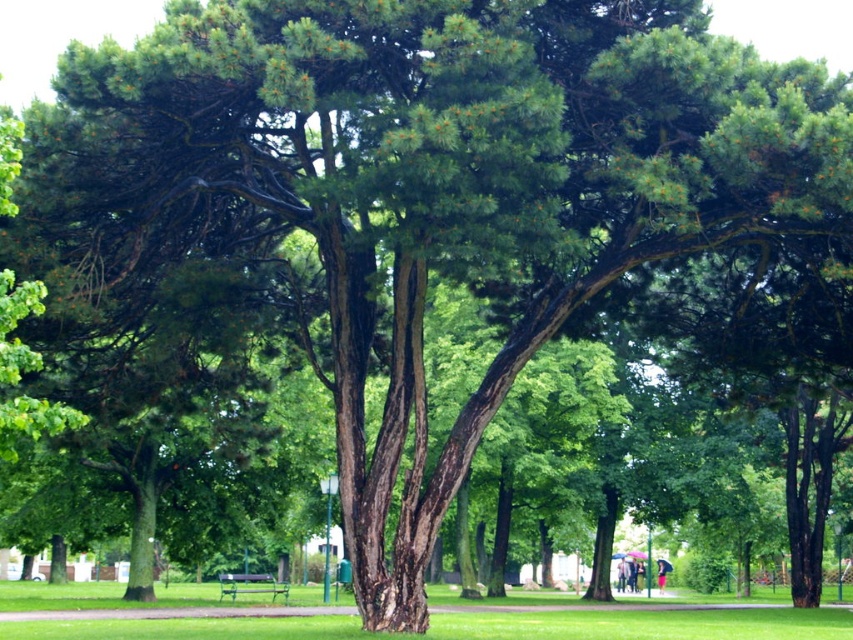
Question: Observing the image, what is the correct spatial positioning of green grass at center in reference to wooden park bench at center?

Choices:
 (A) below
 (B) above

Answer: (B)

Question: Which of the following is the closest to the observer?

Choices:
 (A) green grass at center
 (B) wooden park bench at center

Answer: (A)

Question: Is green grass at center further to camera compared to wooden park bench at center?

Choices:
 (A) no
 (B) yes

Answer: (A)

Question: Among these points, which one is farthest from the camera?

Choices:
 (A) (228, 593)
 (B) (635, 621)

Answer: (A)

Question: Is green grass at center thinner than wooden park bench at center?

Choices:
 (A) no
 (B) yes

Answer: (A)